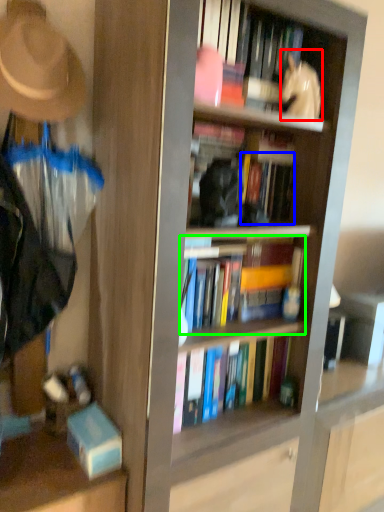
Question: Based on their relative distances, which object is nearer to person (highlighted by a red box)? Choose from book (highlighted by a blue box) and book (highlighted by a green box).

Choices:
 (A) book
 (B) book

Answer: (A)